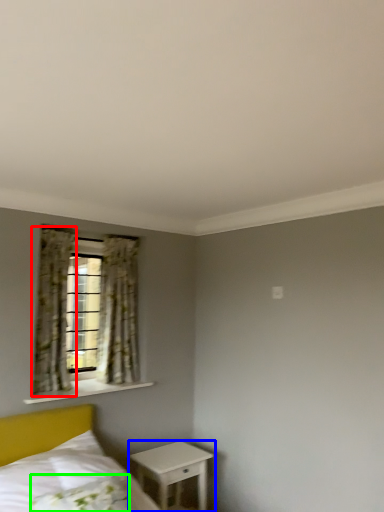
Question: Considering the real-world distances, which object is closest to curtain (highlighted by a red box)? nightstand (highlighted by a blue box) or pillow (highlighted by a green box).

Choices:
 (A) nightstand
 (B) pillow

Answer: (A)